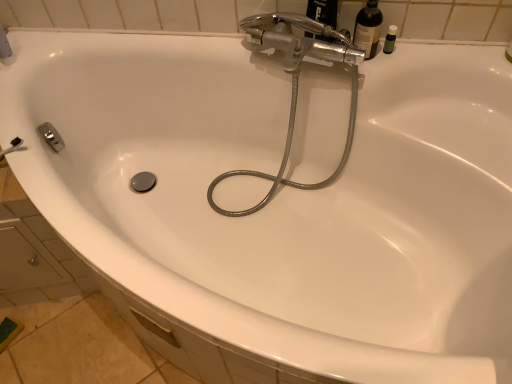
Question: Is translucent glass bottle at upper right far from green plastic bottle at upper right?

Choices:
 (A) yes
 (B) no

Answer: (B)

Question: Is green plastic bottle at upper right at the back of translucent glass bottle at upper right?

Choices:
 (A) no
 (B) yes

Answer: (A)

Question: Could you tell me if translucent glass bottle at upper right is facing green plastic bottle at upper right?

Choices:
 (A) yes
 (B) no

Answer: (B)

Question: Can you confirm if translucent glass bottle at upper right is bigger than green plastic bottle at upper right?

Choices:
 (A) yes
 (B) no

Answer: (A)

Question: From a real-world perspective, is translucent glass bottle at upper right physically above green plastic bottle at upper right?

Choices:
 (A) no
 (B) yes

Answer: (B)

Question: Considering the relative positions of translucent glass bottle at upper right and green plastic bottle at upper right in the image provided, is translucent glass bottle at upper right in front of green plastic bottle at upper right?

Choices:
 (A) yes
 (B) no

Answer: (A)

Question: Is translucent glass bottle at upper right taller than metallic hose at center?

Choices:
 (A) yes
 (B) no

Answer: (B)

Question: Can you confirm if translucent glass bottle at upper right is shorter than metallic hose at center?

Choices:
 (A) yes
 (B) no

Answer: (A)

Question: Does translucent glass bottle at upper right have a greater width compared to metallic hose at center?

Choices:
 (A) yes
 (B) no

Answer: (B)

Question: From a real-world perspective, is translucent glass bottle at upper right below metallic hose at center?

Choices:
 (A) no
 (B) yes

Answer: (A)

Question: Is translucent glass bottle at upper right at the right side of metallic hose at center?

Choices:
 (A) no
 (B) yes

Answer: (B)

Question: Is metallic hose at center a part of translucent glass bottle at upper right?

Choices:
 (A) no
 (B) yes

Answer: (A)

Question: Does green plastic bottle at upper right have a lesser width compared to metallic hose at center?

Choices:
 (A) no
 (B) yes

Answer: (B)